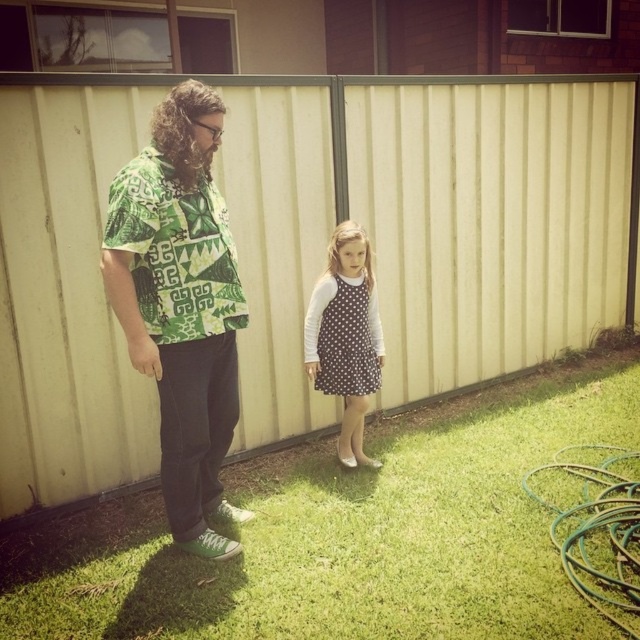
Between point (620, 486) and point (364, 324), which one is positioned in front?

Point (620, 486) is in front.

Does green rubber hose at lower right lie behind brown dotted fabric dress at center?

That is False.

Between point (612, 484) and point (362, 362), which one is positioned in front?

Point (612, 484)

Where is `green rubber hose at lower right`? Image resolution: width=640 pixels, height=640 pixels. green rubber hose at lower right is located at coordinates (598, 532).

Is beige corrugated metal fence at center shorter than polka dot fabric dress at center?

Incorrect, beige corrugated metal fence at center's height does not fall short of polka dot fabric dress at center's.

Is beige corrugated metal fence at center taller than polka dot fabric dress at center?

Yes.

Find the location of a particular element. The height and width of the screenshot is (640, 640). beige corrugated metal fence at center is located at coordinates (426, 225).

Measure the distance between point (129,534) and camera.

They are 3.30 meters apart.

At what (x,y) coordinates should I click in order to perform the action: click on green grass at lower center. Please return your answer as a coordinate pair (x, y). Image resolution: width=640 pixels, height=640 pixels. Looking at the image, I should click on (348, 532).